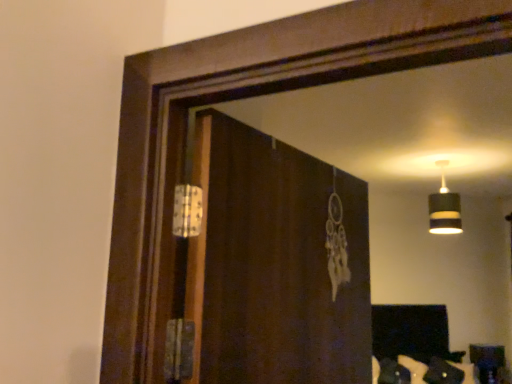
Question: Is brown wooden screen door at center to the right of black striped lampshade at upper right from the viewer's perspective?

Choices:
 (A) no
 (B) yes

Answer: (A)

Question: Can you confirm if brown wooden screen door at center is positioned to the left of black striped lampshade at upper right?

Choices:
 (A) no
 (B) yes

Answer: (B)

Question: Does brown wooden screen door at center have a larger size compared to black striped lampshade at upper right?

Choices:
 (A) yes
 (B) no

Answer: (A)

Question: Does brown wooden screen door at center have a greater height compared to black striped lampshade at upper right?

Choices:
 (A) no
 (B) yes

Answer: (B)

Question: Can you confirm if brown wooden screen door at center is wider than black striped lampshade at upper right?

Choices:
 (A) no
 (B) yes

Answer: (A)

Question: Considering the positions of brown wooden screen door at center and wooden table at lower right in the image, is brown wooden screen door at center taller or shorter than wooden table at lower right?

Choices:
 (A) short
 (B) tall

Answer: (B)

Question: Would you say brown wooden screen door at center is inside or outside wooden table at lower right?

Choices:
 (A) inside
 (B) outside

Answer: (B)

Question: Is brown wooden screen door at center wider or thinner than wooden table at lower right?

Choices:
 (A) wide
 (B) thin

Answer: (B)

Question: Does point [x=273, y=337] appear closer or farther from the camera than point [x=473, y=345]?

Choices:
 (A) farther
 (B) closer

Answer: (B)

Question: Looking at their shapes, would you say wooden table at lower right is wider or thinner than brown wooden screen door at center?

Choices:
 (A) thin
 (B) wide

Answer: (B)

Question: From the image's perspective, is wooden table at lower right located above or below brown wooden screen door at center?

Choices:
 (A) above
 (B) below

Answer: (B)

Question: Considering their positions, is wooden table at lower right located in front of or behind brown wooden screen door at center?

Choices:
 (A) front
 (B) behind

Answer: (B)

Question: Considering the positions of wooden table at lower right and brown wooden screen door at center in the image, is wooden table at lower right taller or shorter than brown wooden screen door at center?

Choices:
 (A) short
 (B) tall

Answer: (A)

Question: Looking at their shapes, would you say brown wooden screen door at center is wider or thinner than black striped lampshade at upper right?

Choices:
 (A) thin
 (B) wide

Answer: (A)

Question: Is brown wooden screen door at center spatially inside black striped lampshade at upper right, or outside of it?

Choices:
 (A) inside
 (B) outside

Answer: (B)